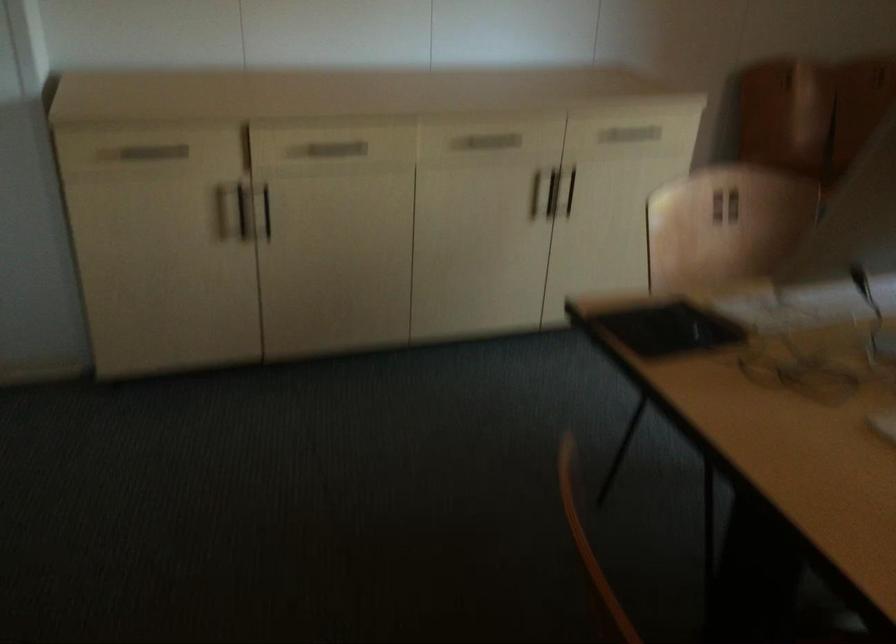
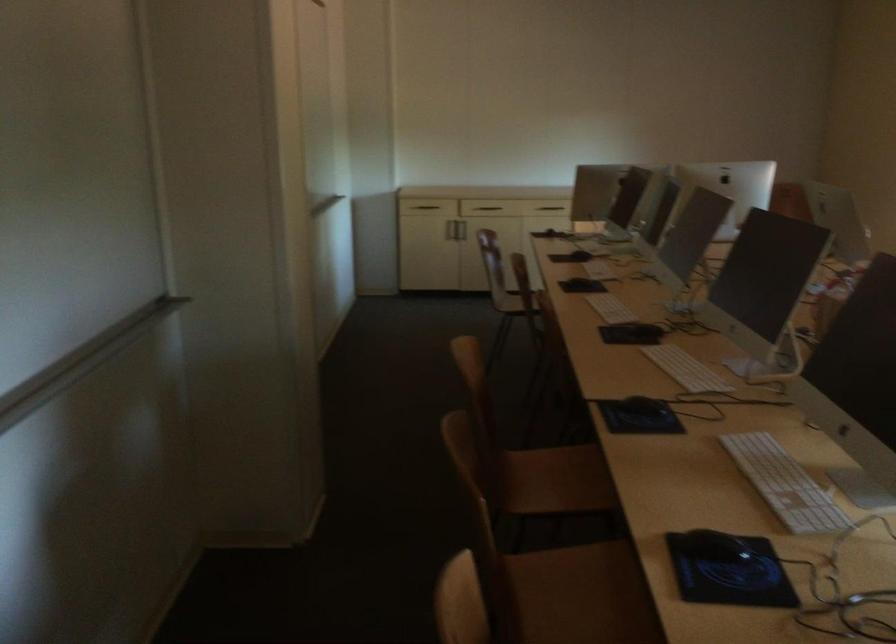
Locate, in the second image, the point that corresponds to (243,211) in the first image.

(455, 213)